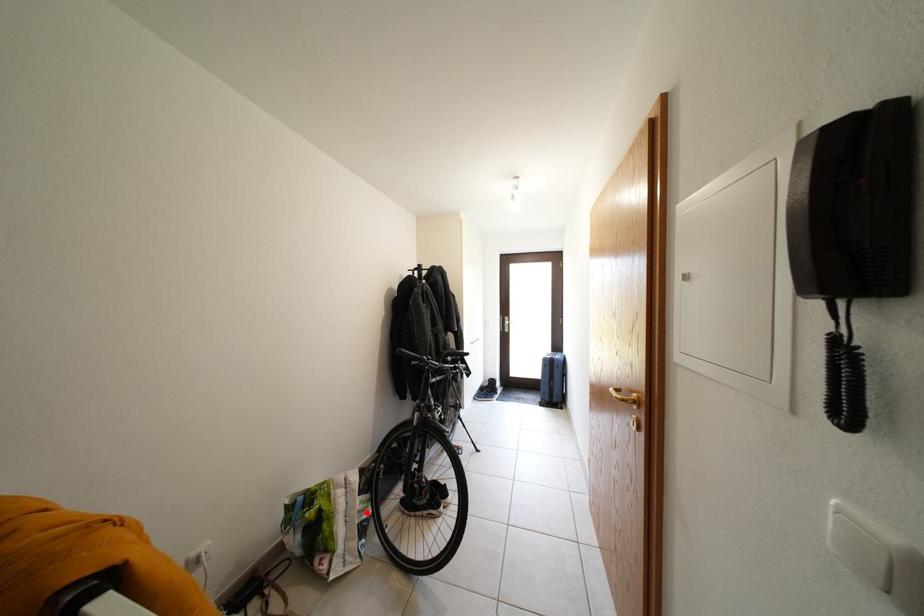
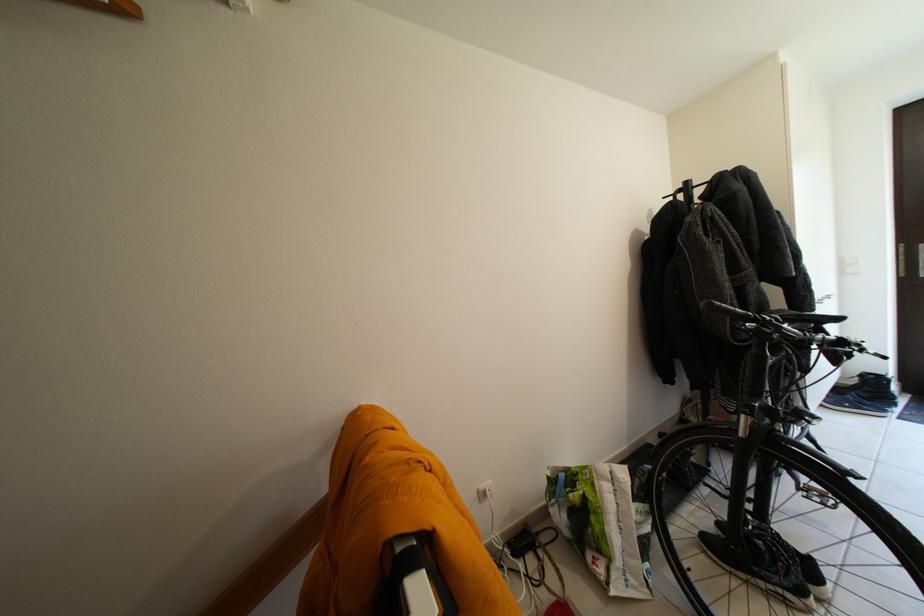
In the second image, find the point that corresponds to the highlighted location in the first image.

(642, 522)